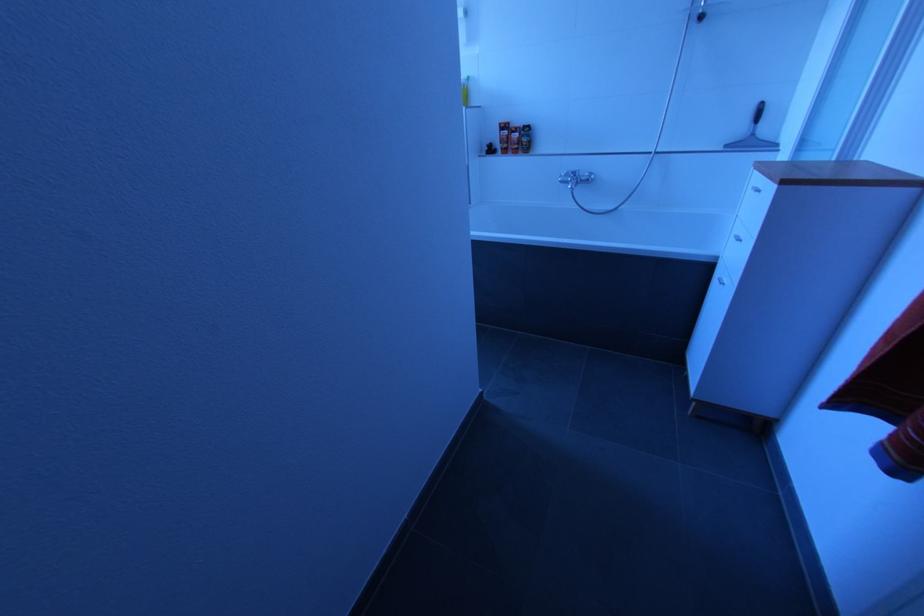
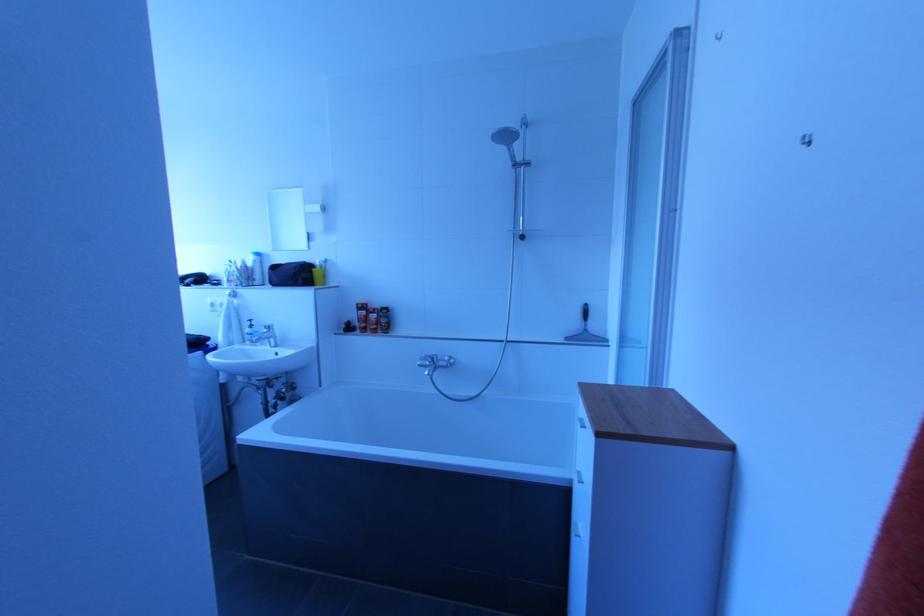
Based on the continuous images, in which direction is the camera rotating?

The camera rotated toward right-up.